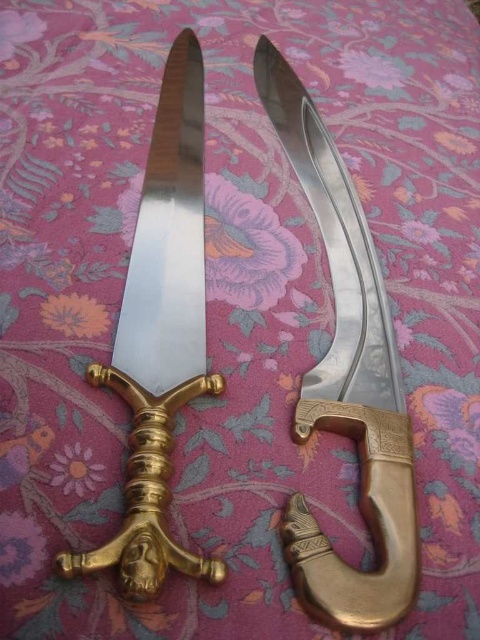
You are an armorer examining two weapons displayed on a vibrant fabric background. You need to determine which weapon takes up more space. Which one is larger in size between the polished brass dagger at center and the polished brass sword at center?

The polished brass sword at center is larger in size because the polished brass dagger at center occupies less space than it.

From the picture: You are a photographer standing 1.02 meters away from the polished brass dagger at center. You want to capture a closeup shot of the dagger while keeping the other sword in the background. Can you do this without moving the camera?

The polished brass dagger at center is 1.02 meters away from the camera, so yes, you can take a closeup shot of the polished brass dagger at center while keeping the other sword in the background without moving the camera.

You are an antique dealer examining two weapons displayed on a table. You have the polished brass sword at center and the polished metal knife at center in front of you. Based on their positions, which one is located to the east side of the other?

The polished brass sword at center is to the right of the polished metal knife at center, so the polished brass sword at center is located to the east side of the polished metal knife at center.